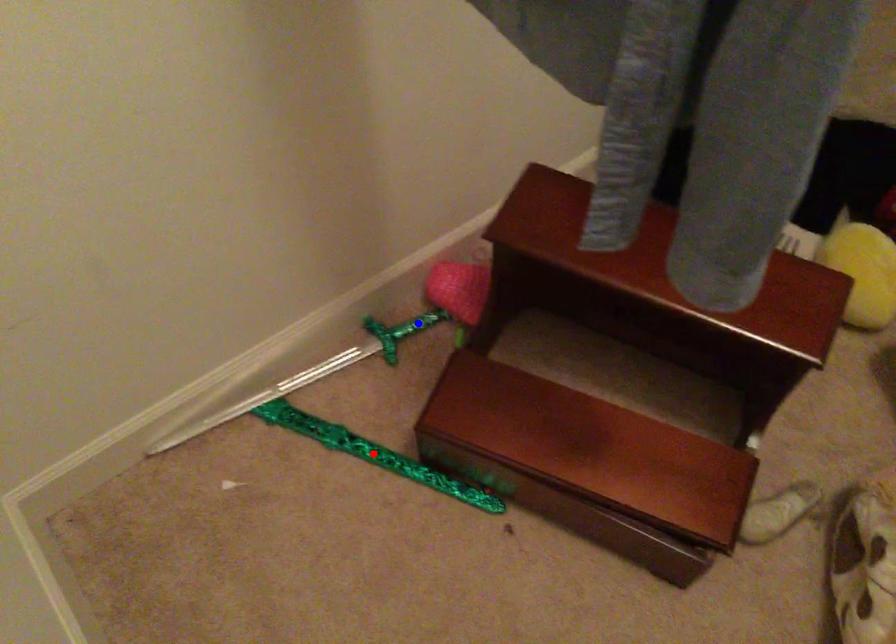
Question: Two points are marked on the image. Which point is closer to the camera?

Choices:
 (A) Blue point is closer.
 (B) Red point is closer.

Answer: (B)